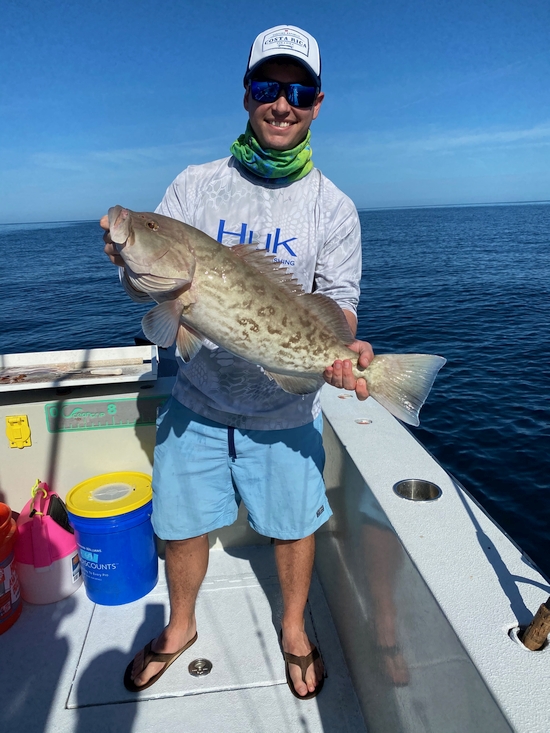
You are a GUI agent. You are given a task and a screenshot of the screen. Output one action in this format:
    pyautogui.click(x=<x>, y=<y>)
    Task: Click on the plastic containers
    
    Given the screenshot: What is the action you would take?
    pyautogui.click(x=57, y=548), pyautogui.click(x=12, y=596)